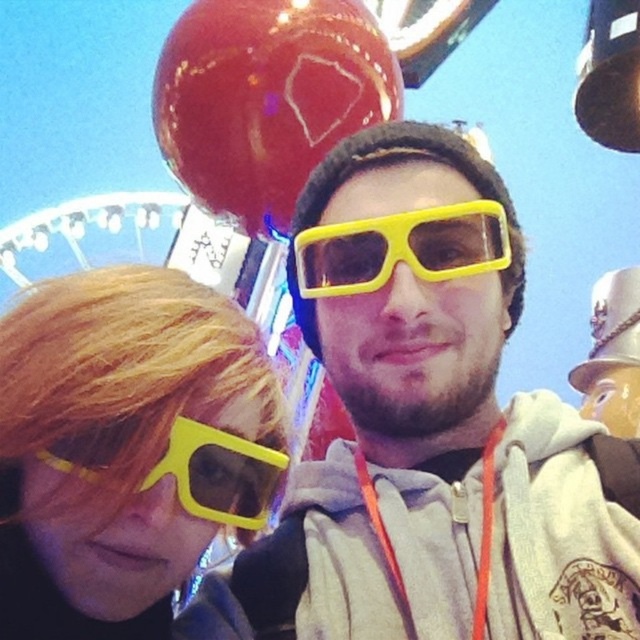
Question: Is matte yellow sunglasses at left bigger than yellow matte sunglasses at lower left?

Choices:
 (A) yes
 (B) no

Answer: (A)

Question: Which point is closer to the camera?

Choices:
 (A) matte yellow sunglasses at left
 (B) yellow matte sunglasses at center

Answer: (A)

Question: Can you confirm if glossy red balloon at upper center is positioned below yellow matte sunglasses at lower left?

Choices:
 (A) no
 (B) yes

Answer: (A)

Question: Which of these objects is positioned closest to the glossy red balloon at upper center?

Choices:
 (A) yellow matte sunglasses at lower left
 (B) matte yellow sunglasses at left

Answer: (B)

Question: Observing the image, what is the correct spatial positioning of glossy red balloon at upper center in reference to yellow matte sunglasses at center?

Choices:
 (A) right
 (B) left

Answer: (B)

Question: Which point is farther from the camera taking this photo?

Choices:
 (A) (234, 490)
 (B) (445, 280)
 (C) (285, 35)
 (D) (106, 403)

Answer: (C)